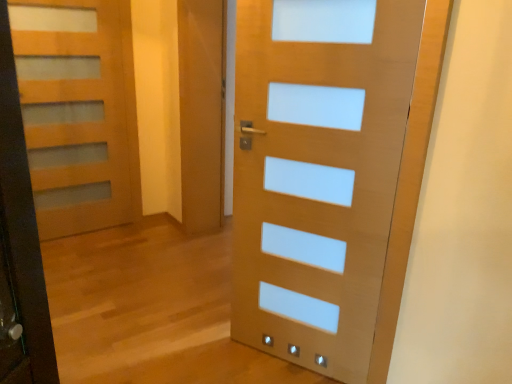
What is the approximate width of matte wood door at left, marked as the second door in a front-to-back arrangement?

matte wood door at left, marked as the second door in a front-to-back arrangement, is 12.16 centimeters in width.

Where is `matte wood door at left, the second door viewed from the right`? matte wood door at left, the second door viewed from the right is located at coordinates pos(78,112).

What do you see at coordinates (78, 112) in the screenshot?
I see `matte wood door at left, the second door viewed from the right` at bounding box center [78, 112].

Where is `matte wood door at center, acting as the second door starting from the back`? matte wood door at center, acting as the second door starting from the back is located at coordinates (318, 172).

Describe the element at coordinates (318, 172) in the screenshot. I see `matte wood door at center, acting as the second door starting from the back` at that location.

Where is `matte wood door at left, which appears as the 1th door when viewed from the back`? This screenshot has width=512, height=384. matte wood door at left, which appears as the 1th door when viewed from the back is located at coordinates (78, 112).

Which object is positioned more to the right, matte wood door at left, marked as the second door in a front-to-back arrangement, or matte wood door at center, the second door viewed from the left?

Positioned to the right is matte wood door at center, the second door viewed from the left.

In the image, is matte wood door at left, which appears as the 1th door when viewed from the back, positioned in front of or behind matte wood door at center, acting as the second door starting from the back?

Clearly, matte wood door at left, which appears as the 1th door when viewed from the back, is behind matte wood door at center, acting as the second door starting from the back.

Between point (129, 195) and point (334, 176), which one is positioned behind?

The point (129, 195) is farther.

From the image's perspective, which one is positioned lower, matte wood door at left, which appears as the 1th door when viewed from the back, or matte wood door at center, marked as the first door in a front-to-back arrangement?

matte wood door at center, marked as the first door in a front-to-back arrangement, is shown below in the image.

From a real-world perspective, who is located lower, matte wood door at left, the second door viewed from the right, or matte wood door at center, marked as the first door in a front-to-back arrangement?

matte wood door at center, marked as the first door in a front-to-back arrangement.

Which object is thinner, matte wood door at left, the second door viewed from the right, or matte wood door at center, arranged as the 1th door when viewed from the right?

matte wood door at left, the second door viewed from the right, is thinner.

Considering the sizes of objects matte wood door at left, marked as the 1th door in a left-to-right arrangement, and matte wood door at center, the second door viewed from the left, in the image provided, who is taller, matte wood door at left, marked as the 1th door in a left-to-right arrangement, or matte wood door at center, the second door viewed from the left,?

matte wood door at left, marked as the 1th door in a left-to-right arrangement.

Looking at the image, does matte wood door at left, which appears as the 1th door when viewed from the back, seem bigger or smaller compared to matte wood door at center, marked as the first door in a front-to-back arrangement?

matte wood door at left, which appears as the 1th door when viewed from the back, is smaller than matte wood door at center, marked as the first door in a front-to-back arrangement.

Is matte wood door at left, marked as the 1th door in a left-to-right arrangement, located outside matte wood door at center, acting as the second door starting from the back?

Yes, matte wood door at left, marked as the 1th door in a left-to-right arrangement, is located beyond the bounds of matte wood door at center, acting as the second door starting from the back.

Is matte wood door at left, which appears as the 1th door when viewed from the back, not near matte wood door at center, the second door viewed from the left?

matte wood door at left, which appears as the 1th door when viewed from the back, is positioned a significant distance from matte wood door at center, the second door viewed from the left.

Is matte wood door at left, marked as the second door in a front-to-back arrangement, turned away from matte wood door at center, acting as the second door starting from the back?

matte wood door at left, marked as the second door in a front-to-back arrangement, is not turned away from matte wood door at center, acting as the second door starting from the back.

Can you tell me how much matte wood door at left, marked as the second door in a front-to-back arrangement, and matte wood door at center, the second door viewed from the left, differ in facing direction?

There is a 117-degree angle between the facing directions of matte wood door at left, marked as the second door in a front-to-back arrangement, and matte wood door at center, the second door viewed from the left.

Image resolution: width=512 pixels, height=384 pixels. In order to click on door that appears behind the matte wood door at center, the second door viewed from the left in this screenshot , I will do pos(78,112).

Between matte wood door at center, acting as the second door starting from the back, and matte wood door at left, which appears as the 1th door when viewed from the back, which one appears on the right side from the viewer's perspective?

From the viewer's perspective, matte wood door at center, acting as the second door starting from the back, appears more on the right side.

Considering the positions of objects matte wood door at center, the second door viewed from the left, and matte wood door at left, which appears as the 1th door when viewed from the back, in the image provided, who is behind, matte wood door at center, the second door viewed from the left, or matte wood door at left, which appears as the 1th door when viewed from the back,?

matte wood door at left, which appears as the 1th door when viewed from the back, is further away from the camera.

Is point (305, 214) closer to camera compared to point (132, 146)?

Yes, point (305, 214) is in front of point (132, 146).

From the image's perspective, is matte wood door at center, acting as the second door starting from the back, on matte wood door at left, marked as the second door in a front-to-back arrangement?

Actually, matte wood door at center, acting as the second door starting from the back, appears below matte wood door at left, marked as the second door in a front-to-back arrangement, in the image.

From a real-world perspective, is matte wood door at center, marked as the first door in a front-to-back arrangement, above or below matte wood door at left, the second door viewed from the right?

matte wood door at center, marked as the first door in a front-to-back arrangement, is below matte wood door at left, the second door viewed from the right.

Considering the sizes of objects matte wood door at center, marked as the first door in a front-to-back arrangement, and matte wood door at left, marked as the 1th door in a left-to-right arrangement, in the image provided, who is wider, matte wood door at center, marked as the first door in a front-to-back arrangement, or matte wood door at left, marked as the 1th door in a left-to-right arrangement,?

matte wood door at center, marked as the first door in a front-to-back arrangement, is wider.

Considering the relative sizes of matte wood door at center, acting as the second door starting from the back, and matte wood door at left, the second door viewed from the right, in the image provided, is matte wood door at center, acting as the second door starting from the back, shorter than matte wood door at left, the second door viewed from the right,?

Indeed, matte wood door at center, acting as the second door starting from the back, has a lesser height compared to matte wood door at left, the second door viewed from the right.

Considering the sizes of objects matte wood door at center, arranged as the 1th door when viewed from the right, and matte wood door at left, which appears as the 1th door when viewed from the back, in the image provided, who is bigger, matte wood door at center, arranged as the 1th door when viewed from the right, or matte wood door at left, which appears as the 1th door when viewed from the back,?

matte wood door at center, arranged as the 1th door when viewed from the right.

Consider the image. Is matte wood door at center, acting as the second door starting from the back, outside of matte wood door at left, which appears as the 1th door when viewed from the back?

Absolutely, matte wood door at center, acting as the second door starting from the back, is external to matte wood door at left, which appears as the 1th door when viewed from the back.

Is the surface of matte wood door at center, acting as the second door starting from the back, in direct contact with matte wood door at left, marked as the 1th door in a left-to-right arrangement?

No, matte wood door at center, acting as the second door starting from the back, is not making contact with matte wood door at left, marked as the 1th door in a left-to-right arrangement.

Is matte wood door at center, acting as the second door starting from the back, positioned with its back to matte wood door at left, which appears as the 1th door when viewed from the back?

No.

Based on the photo, how different are the orientations of matte wood door at center, marked as the first door in a front-to-back arrangement, and matte wood door at left, which appears as the 1th door when viewed from the back, in degrees?

There is a 117-degree angle between the facing directions of matte wood door at center, marked as the first door in a front-to-back arrangement, and matte wood door at left, which appears as the 1th door when viewed from the back.

The height and width of the screenshot is (384, 512). Find the location of `door lying in front of the matte wood door at left, marked as the second door in a front-to-back arrangement`. door lying in front of the matte wood door at left, marked as the second door in a front-to-back arrangement is located at coordinates click(x=318, y=172).

The width and height of the screenshot is (512, 384). Identify the location of door located underneath the matte wood door at left, marked as the 1th door in a left-to-right arrangement (from a real-world perspective). (318, 172).

Identify the location of door on the left side of matte wood door at center, arranged as the 1th door when viewed from the right. (78, 112).